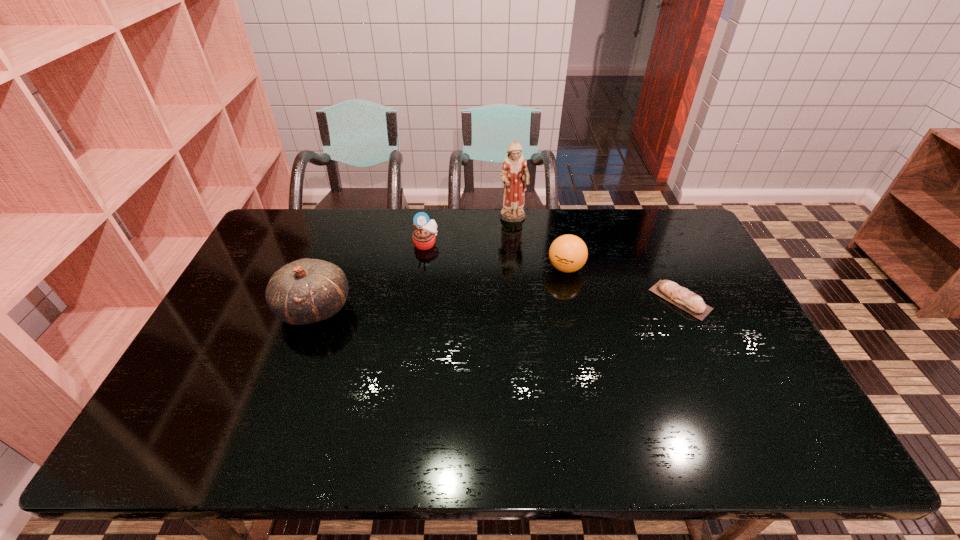
At what (x,y) coordinates should I click in order to perform the action: click on the fourth shortest object. Please return your answer as a coordinate pair (x, y). The height and width of the screenshot is (540, 960). Looking at the image, I should click on (305, 291).

I want to click on the leftmost object, so click(305, 291).

Find the location of a particular element. The height and width of the screenshot is (540, 960). pita bread is located at coordinates (688, 301).

I want to click on the shortest object, so click(688, 301).

Locate an element on the screen. This screenshot has height=540, width=960. ping-pong ball is located at coordinates (568, 253).

You are a GUI agent. You are given a task and a screenshot of the screen. Output one action in this format:
    pyautogui.click(x=<x>, y=<y>)
    Task: Click on the second object from left to right
    The image size is (960, 540).
    Given the screenshot: What is the action you would take?
    pyautogui.click(x=424, y=235)

At what (x,y) coordinates should I click in order to perform the action: click on the fourth nearest object. Please return your answer as a coordinate pair (x, y). Image resolution: width=960 pixels, height=540 pixels. Looking at the image, I should click on (424, 235).

The image size is (960, 540). What are the coordinates of `the tallest object` in the screenshot? It's located at (515, 175).

Image resolution: width=960 pixels, height=540 pixels. In order to click on the farthest object in this screenshot , I will do `click(515, 175)`.

Identify the location of free spot located 0.370m on the right of the gourd. (478, 308).